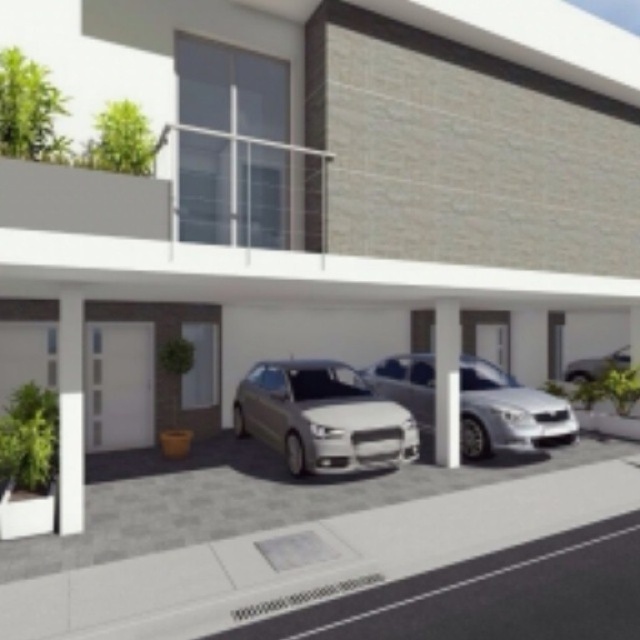
Is satin silver car at center below satin silver sedan at right?

No.

Is satin silver car at center smaller than satin silver sedan at right?

No.

Measure the distance between point (429, 365) and camera.

Point (429, 365) and camera are 46.10 feet apart.

In order to click on satin silver car at center in this screenshot , I will do `click(508, 412)`.

Between satin gold car at center and satin silver car at center, which one appears on the left side from the viewer's perspective?

satin gold car at center

Does satin gold car at center appear on the right side of satin silver car at center?

Incorrect, satin gold car at center is not on the right side of satin silver car at center.

Is point (376, 397) closer to camera compared to point (573, 419)?

Yes, point (376, 397) is closer to viewer.

This screenshot has height=640, width=640. What are the coordinates of `satin gold car at center` in the screenshot? It's located at (323, 417).

Consider the image. Is satin gold car at center below satin silver sedan at right?

Yes, satin gold car at center is below satin silver sedan at right.

The height and width of the screenshot is (640, 640). Identify the location of satin gold car at center. (323, 417).

Which is in front, point (275, 388) or point (602, 372)?

Point (275, 388) is more forward.

This screenshot has width=640, height=640. What are the coordinates of `satin gold car at center` in the screenshot? It's located at (323, 417).